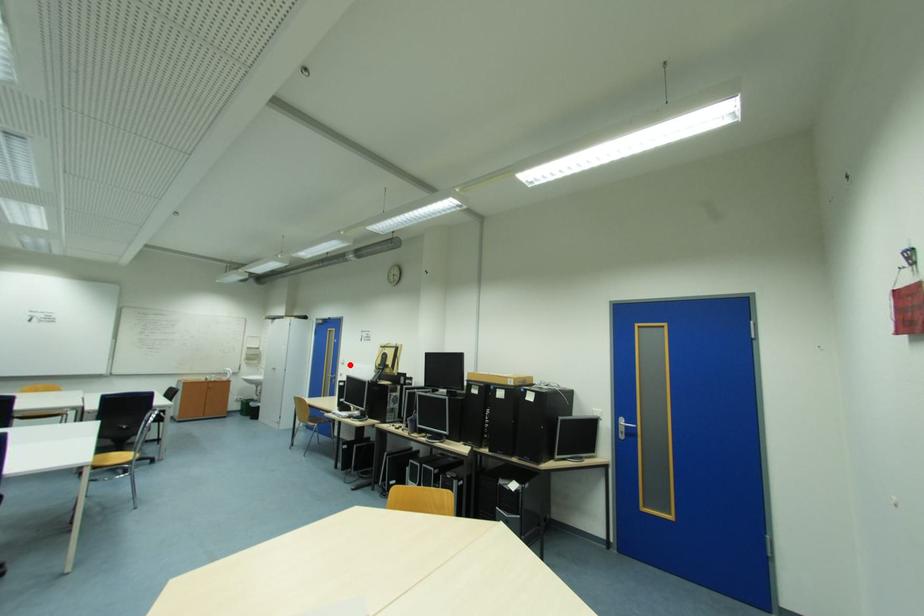
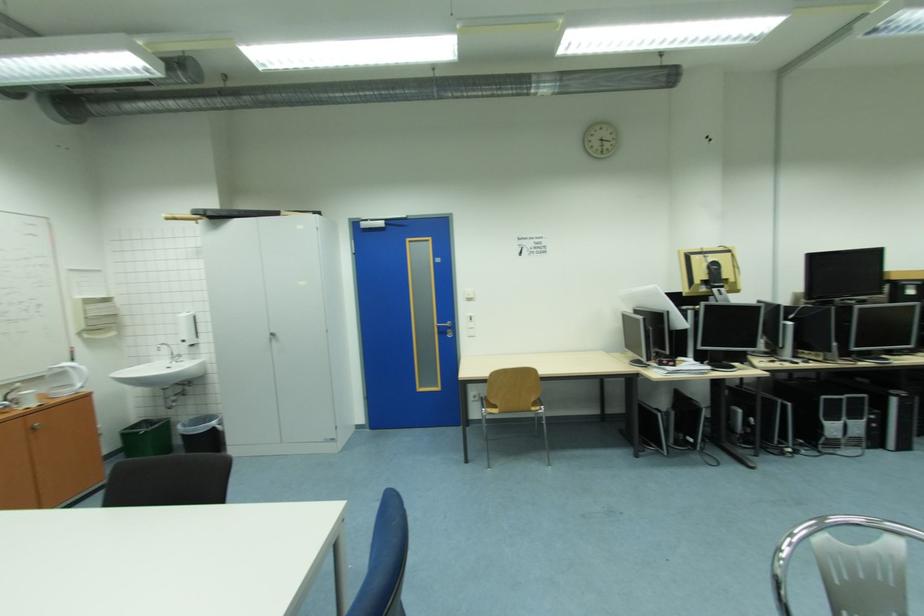
In the second image, find the point that corresponds to the highlighted location in the first image.

(477, 301)